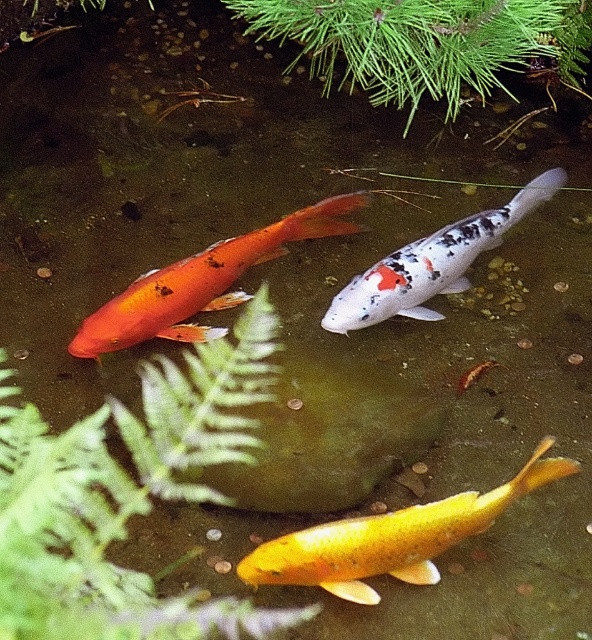
Question: Which point appears farthest from the camera in this image?

Choices:
 (A) (458, 497)
 (B) (340, 314)
 (C) (139, 337)
 (D) (34, 412)

Answer: (C)

Question: Which point is closer to the camera?

Choices:
 (A) green leafy fern at upper left
 (B) shiny orange fish at center
 (C) white speckled fish at center

Answer: (A)

Question: Where is green leafy fern at upper left located in relation to shiny orange fish at center in the image?

Choices:
 (A) below
 (B) above

Answer: (A)

Question: Does green leafy fern at upper left have a larger size compared to white speckled fish at center?

Choices:
 (A) yes
 (B) no

Answer: (A)

Question: Does shiny orange fish at center appear on the left side of white speckled fish at center?

Choices:
 (A) no
 (B) yes

Answer: (B)

Question: Which point is farther to the camera?

Choices:
 (A) (452, 508)
 (B) (66, 444)
 (C) (423, 310)

Answer: (C)